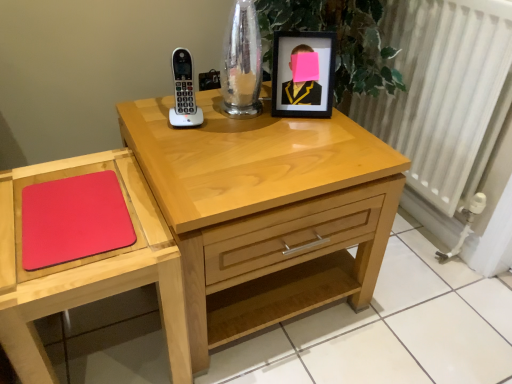
You are a GUI agent. You are given a task and a screenshot of the screen. Output one action in this format:
    pyautogui.click(x=<x>, y=<y>)
    Task: Click on the free region on the left part of white plastic phone at upper center
    Image resolution: width=512 pixels, height=384 pixels.
    Given the screenshot: What is the action you would take?
    pyautogui.click(x=149, y=116)